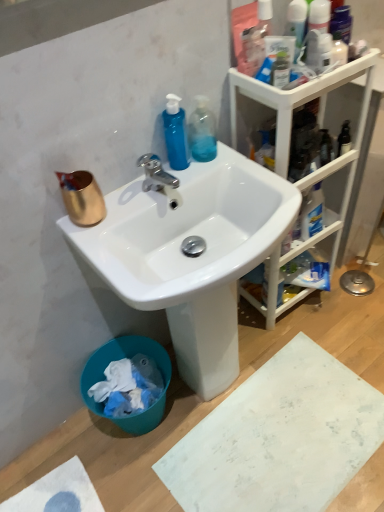
I want to click on vacant area located to the right-hand side of copper metallic cup at upper left, so click(x=132, y=203).